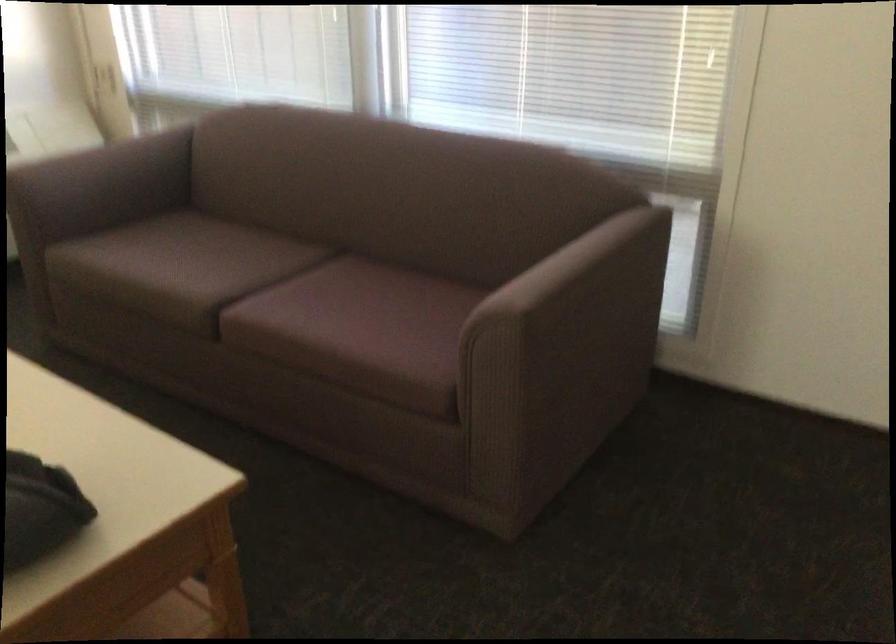
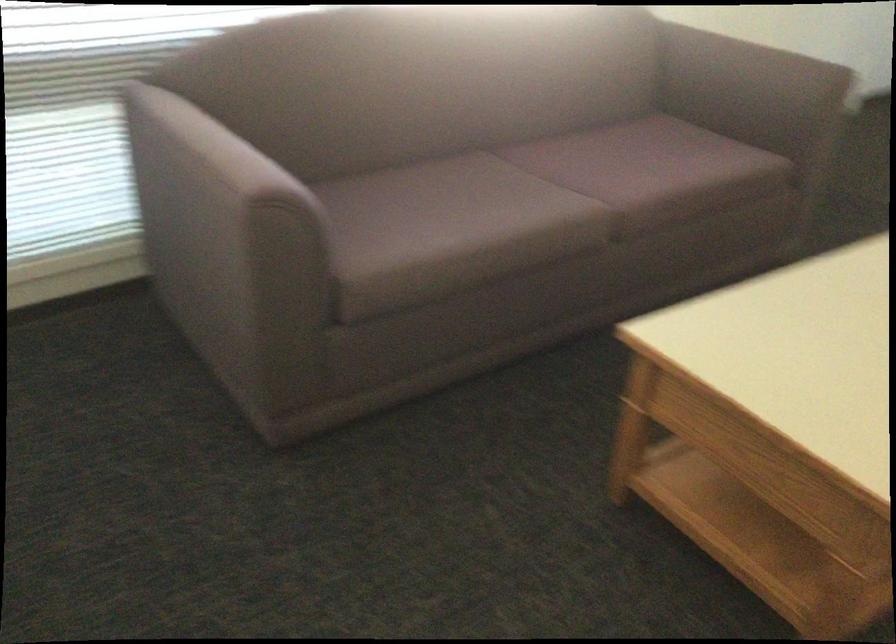
In the second image, find the point that corresponds to the point at 183,274 in the first image.

(528, 205)